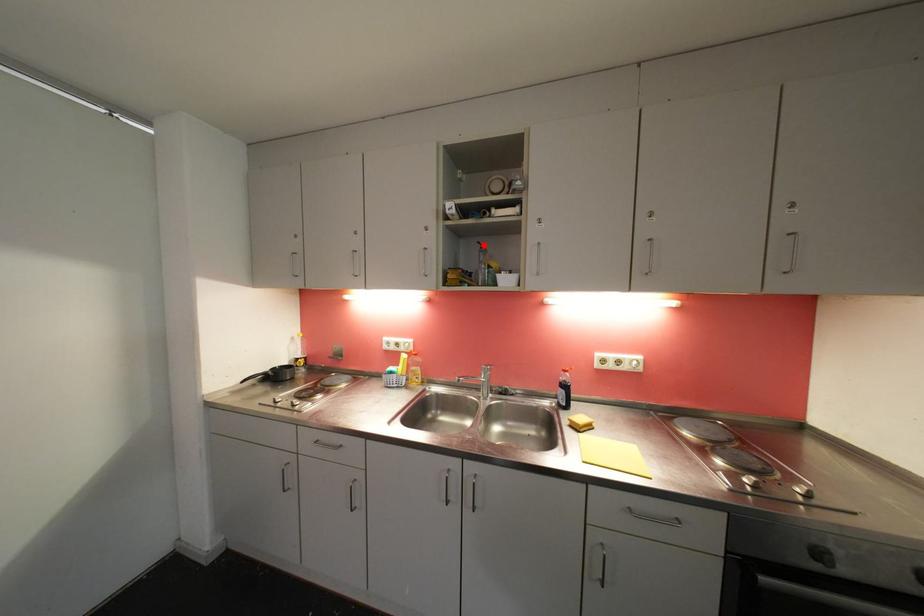
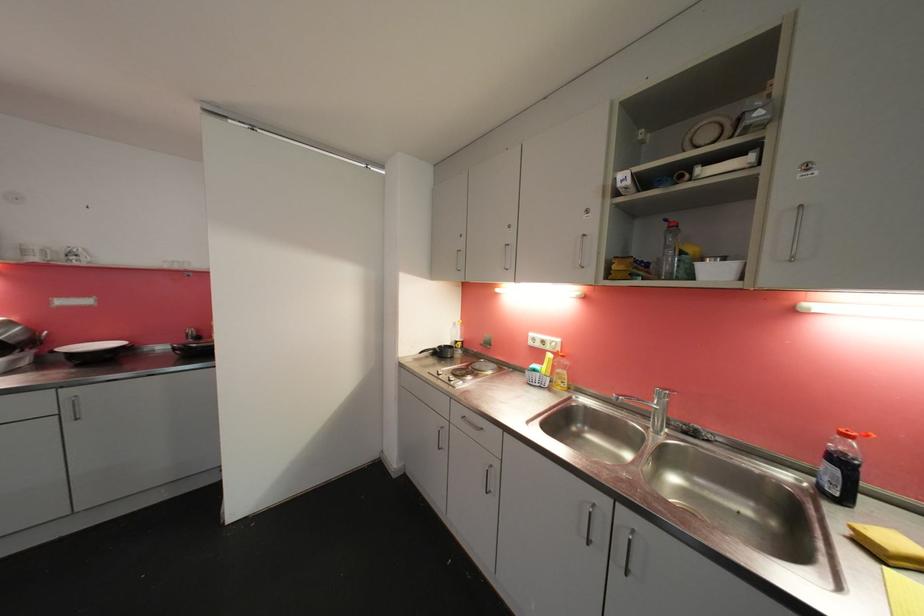
Locate, in the second image, the point that corresponds to the highlighted location in the first image.

(671, 223)